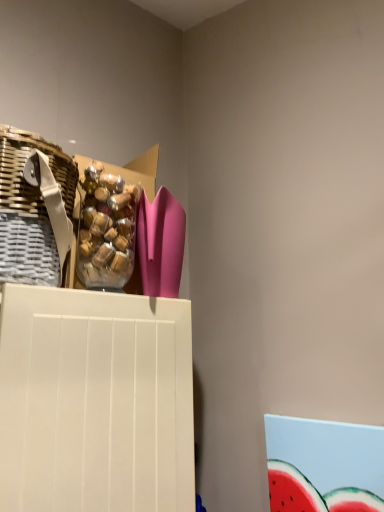
Question: Considering the relative sizes of translucent plastic bag of candies at upper left and woven brown basket at left in the image provided, is translucent plastic bag of candies at upper left smaller than woven brown basket at left?

Choices:
 (A) no
 (B) yes

Answer: (B)

Question: Does translucent plastic bag of candies at upper left have a lesser width compared to woven brown basket at left?

Choices:
 (A) no
 (B) yes

Answer: (B)

Question: Is translucent plastic bag of candies at upper left at the left side of woven brown basket at left?

Choices:
 (A) no
 (B) yes

Answer: (A)

Question: Can we say translucent plastic bag of candies at upper left lies outside woven brown basket at left?

Choices:
 (A) yes
 (B) no

Answer: (A)

Question: Is translucent plastic bag of candies at upper left aimed at woven brown basket at left?

Choices:
 (A) yes
 (B) no

Answer: (B)

Question: Is translucent plastic bag of candies at upper left behind woven brown basket at left?

Choices:
 (A) yes
 (B) no

Answer: (A)

Question: Is woven brown basket at left outside translucent plastic bag of candies at upper left?

Choices:
 (A) yes
 (B) no

Answer: (A)

Question: From the image's perspective, is woven brown basket at left under translucent plastic bag of candies at upper left?

Choices:
 (A) no
 (B) yes

Answer: (A)

Question: Is woven brown basket at left aimed at translucent plastic bag of candies at upper left?

Choices:
 (A) no
 (B) yes

Answer: (A)

Question: Is woven brown basket at left to the left of translucent plastic bag of candies at upper left from the viewer's perspective?

Choices:
 (A) yes
 (B) no

Answer: (A)

Question: Is woven brown basket at left facing away from translucent plastic bag of candies at upper left?

Choices:
 (A) yes
 (B) no

Answer: (B)

Question: Is woven brown basket at left bigger than translucent plastic bag of candies at upper left?

Choices:
 (A) yes
 (B) no

Answer: (A)

Question: Visually, is translucent plastic bag of candies at upper left positioned to the left or to the right of woven brown basket at left?

Choices:
 (A) right
 (B) left

Answer: (A)